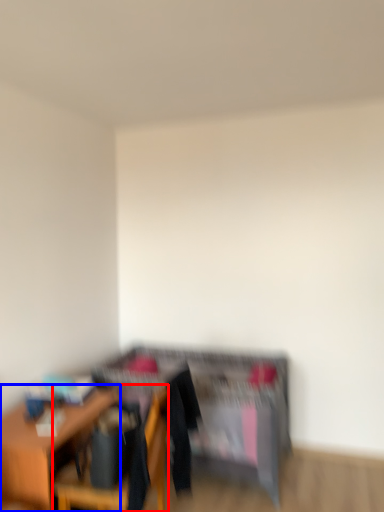
Question: Which point is closer to the camera, chair (highlighted by a red box) or table (highlighted by a blue box)?

Choices:
 (A) chair
 (B) table

Answer: (A)